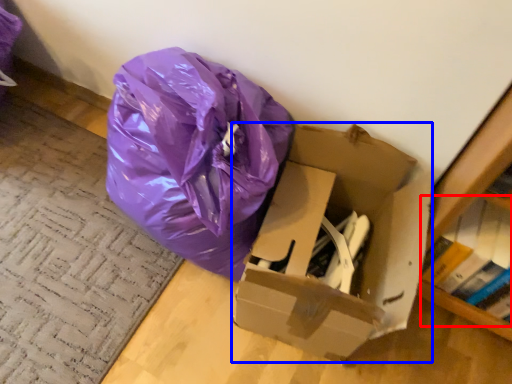
Question: Which of the following is the farthest to the observer, book (highlighted by a red box) or box (highlighted by a blue box)?

Choices:
 (A) book
 (B) box

Answer: (A)